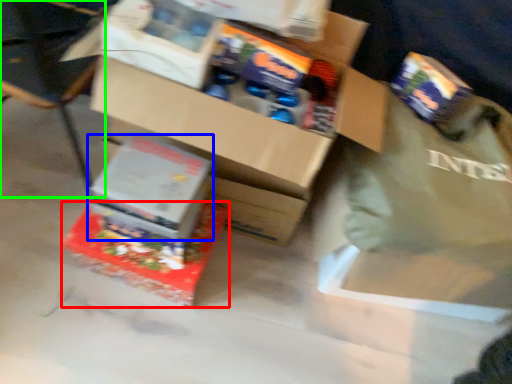
Question: Which is farther away from box (highlighted by a red box)? box (highlighted by a blue box) or chair (highlighted by a green box)?

Choices:
 (A) box
 (B) chair

Answer: (B)